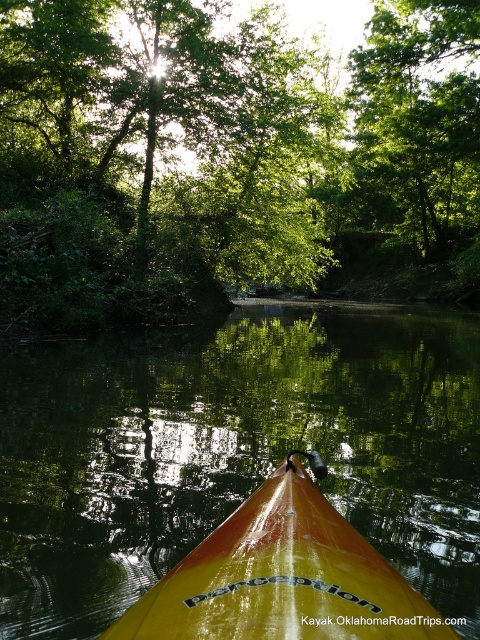
Question: Among these points, which one is nearest to the camera?

Choices:
 (A) (384, 524)
 (B) (411, 616)

Answer: (B)

Question: Can you confirm if yellow glossy kayak at lower center is bigger than yellow glossy kayak at center?

Choices:
 (A) yes
 (B) no

Answer: (A)

Question: Can you confirm if green leafy trees at center is positioned to the left of green leafy tree at upper center?

Choices:
 (A) no
 (B) yes

Answer: (B)

Question: Which point appears farthest from the camera in this image?

Choices:
 (A) (425, 164)
 (B) (272, 184)
 (C) (294, 570)

Answer: (A)

Question: Which point appears farthest from the camera in this image?

Choices:
 (A) (156, 554)
 (B) (207, 198)

Answer: (B)

Question: Does yellow glossy kayak at lower center appear under yellow glossy kayak at center?

Choices:
 (A) no
 (B) yes

Answer: (A)